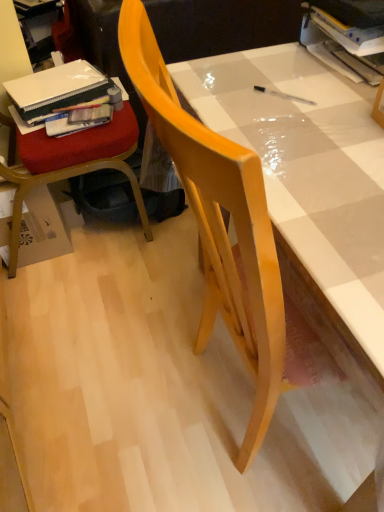
Identify the location of vacant area that is in front of matte plastic book at upper right, the 1th book when ordered from right to left. The image size is (384, 512). (338, 101).